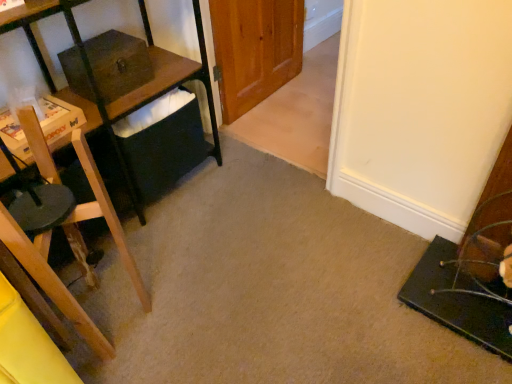
You are a GUI agent. You are given a task and a screenshot of the screen. Output one action in this format:
    pyautogui.click(x=<x>, y=<y>)
    Task: Click on the unoccupied area behind wooden chair at left
    This screenshot has width=512, height=384.
    Given the screenshot: What is the action you would take?
    pyautogui.click(x=137, y=252)